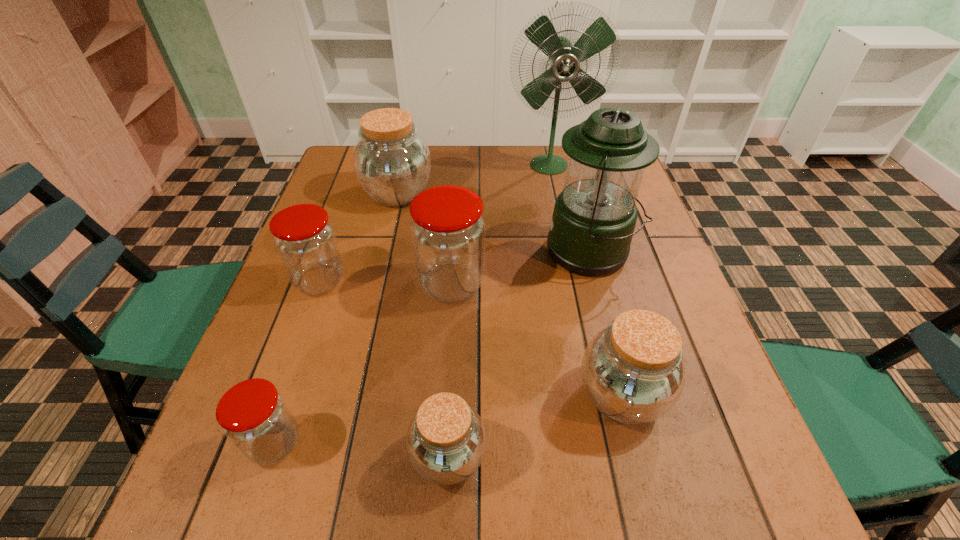
Find the location of `the nearest red jar`. the nearest red jar is located at coordinates (255, 417).

I want to click on the smallest brown jar, so pyautogui.click(x=446, y=440).

You are a GUI agent. You are given a task and a screenshot of the screen. Output one action in this format:
    pyautogui.click(x=<x>, y=<y>)
    Task: Click on the vacant point located 0.240m on the front-facing side of the tallest object
    This screenshot has height=540, width=960.
    Given the screenshot: What is the action you would take?
    pyautogui.click(x=563, y=231)

At what (x,y) coordinates should I click in order to perform the action: click on blank space located 0.380m on the back of the green lantern. Please return your answer as a coordinate pair (x, y). This screenshot has height=540, width=960. Looking at the image, I should click on (564, 152).

Locate an element on the screen. The height and width of the screenshot is (540, 960). blank area located on the right of the leftmost brown jar is located at coordinates (532, 194).

Find the location of a particular element. This screenshot has width=960, height=540. blank space located on the back of the biggest red jar is located at coordinates (457, 202).

I want to click on blank area located 0.260m on the back of the second biggest red jar, so click(x=349, y=199).

Image resolution: width=960 pixels, height=540 pixels. What are the coordinates of `free region located on the front of the second smallest brown jar` in the screenshot? It's located at click(x=640, y=469).

Image resolution: width=960 pixels, height=540 pixels. Identify the location of free space located 0.290m on the back of the smallest red jar. (324, 296).

The height and width of the screenshot is (540, 960). What are the coordinates of `vacant space situated 0.370m on the back of the second brown jar from right to left` in the screenshot? It's located at (458, 273).